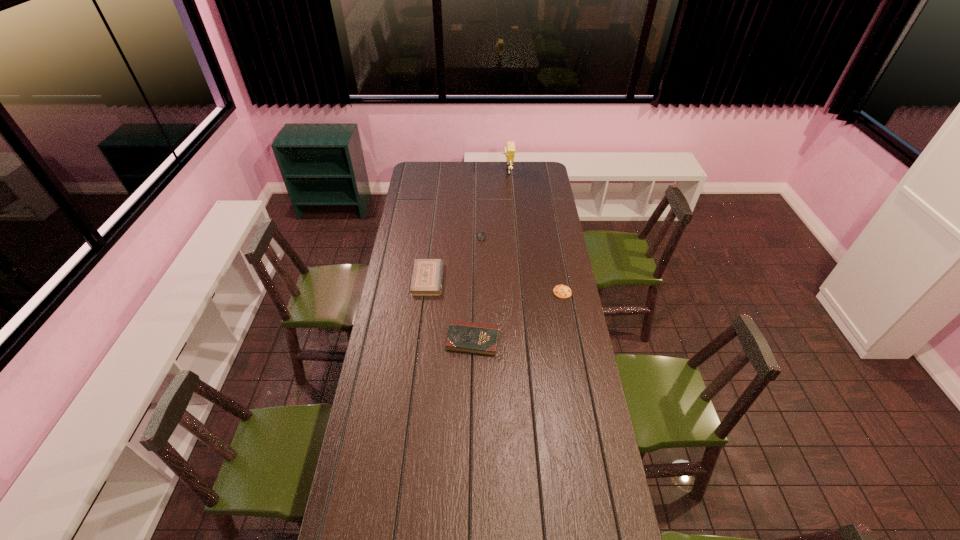
Identify the location of free space between the fourth nearest object and the farther Bible. (455, 259).

In order to click on vacant space that is in between the fourth nearest object and the nearest object in this screenshot , I will do `click(477, 289)`.

Where is `vacant space in between the computer mouse and the rightmost object`? vacant space in between the computer mouse and the rightmost object is located at coordinates 521,265.

Identify the location of object that is the closest to the leftmost object. The width and height of the screenshot is (960, 540). (468, 337).

Identify which object is the second closest to the nearer Bible. Please provide its 2D coordinates. Your answer should be formatted as a tuple, i.e. [(x, y)], where the tuple contains the x and y coordinates of a point satisfying the conditions above.

[(561, 291)]

The height and width of the screenshot is (540, 960). Find the location of `free space that satisfies the following two spatial constraints: 1. on the back side of the fourth nearest object; 2. on the left side of the nearer Bible`. free space that satisfies the following two spatial constraints: 1. on the back side of the fourth nearest object; 2. on the left side of the nearer Bible is located at coordinates (474, 238).

The image size is (960, 540). In order to click on free space that satisfies the following two spatial constraints: 1. on the spine side of the cookie; 2. on the right side of the left Bible in this screenshot , I will do `click(426, 292)`.

The width and height of the screenshot is (960, 540). What are the coordinates of `free location that satisfies the following two spatial constraints: 1. on the spine side of the rightmost object; 2. on the left side of the farther Bible` in the screenshot? It's located at (426, 292).

Locate an element on the screen. The image size is (960, 540). vacant space that satisfies the following two spatial constraints: 1. on the face of the sponge; 2. on the front side of the second shortest object is located at coordinates (513, 238).

Image resolution: width=960 pixels, height=540 pixels. Identify the location of blank area in the image that satisfies the following two spatial constraints: 1. on the spine side of the nearer Bible; 2. on the left side of the farther Bible. (421, 340).